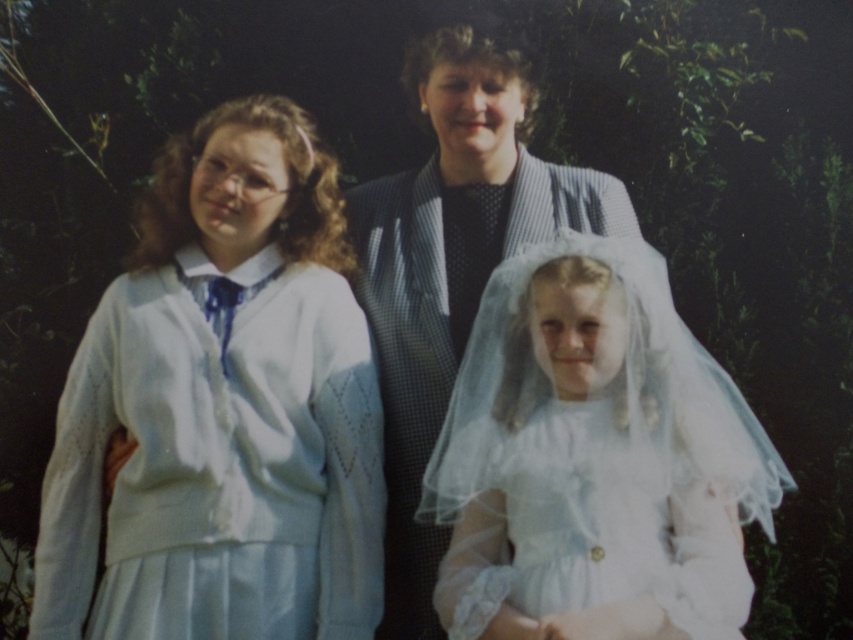
Question: Based on their relative distances, which object is farther from the white knitted dress at left?

Choices:
 (A) white satin dress at center
 (B) matte gray suit at center

Answer: (A)

Question: Is white knitted dress at left thinner than matte gray suit at center?

Choices:
 (A) no
 (B) yes

Answer: (A)

Question: Which point appears farthest from the camera in this image?

Choices:
 (A) (415, 90)
 (B) (329, 605)
 (C) (596, 474)
 (D) (438, 612)

Answer: (A)

Question: Is white knitted dress at left above white sheer veil at center?

Choices:
 (A) no
 (B) yes

Answer: (B)

Question: Is white knitted dress at left positioned before white satin dress at center?

Choices:
 (A) no
 (B) yes

Answer: (A)

Question: Which point is farther to the camera?

Choices:
 (A) matte gray suit at center
 (B) white sheer veil at center
 (C) white satin dress at center
 (D) white knitted dress at left

Answer: (A)